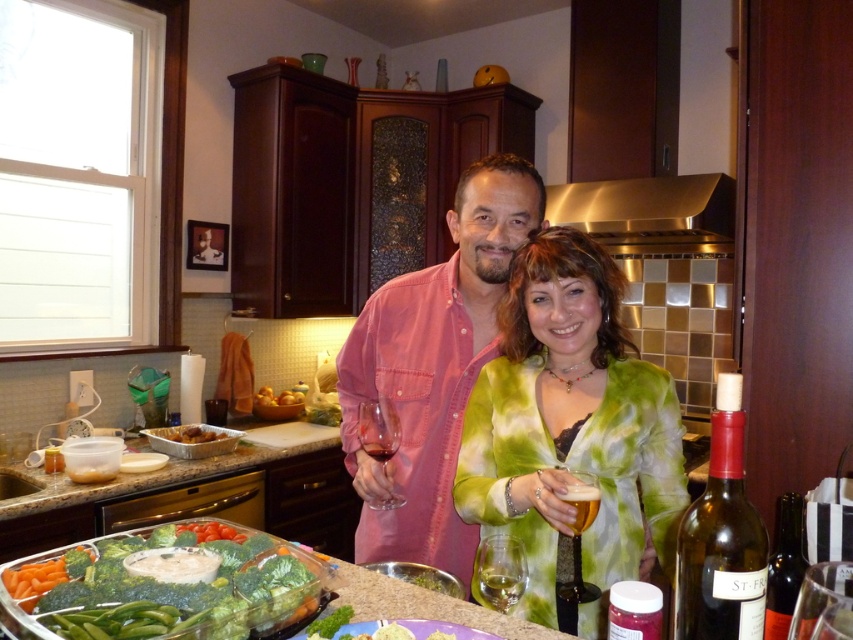
Based on the photo, you are standing in the kitchen and want to reach both points in the image. Which point, point (711, 604) or point (519, 596), will you reach first if you move straight towards them?

Point (711, 604) is closer to the camera than point (519, 596), so you will reach point (711, 604) first.

You are a chef in the kitchen and want to place the golden brown crispy chicken at center on the counter near the stainless steel exhaust hood at upper center. Based on their positions, which direction should you move the chicken to align it under the hood?

The stainless steel exhaust hood at upper center is to the right of the golden brown crispy chicken at center, so you should move the chicken to the right to align it under the hood.

You are preparing to take a photo of the golden brown crispy chicken at center for an online recipe. To ensure the stainless steel exhaust hood at upper center does not overshadow the chicken in the shot, should you zoom in or zoom out?

The stainless steel exhaust hood at upper center is larger than the golden brown crispy chicken at center. To prevent the hood from overshadowing the chicken, you should zoom in to make the chicken appear larger in the frame while reducing the hood visibility.